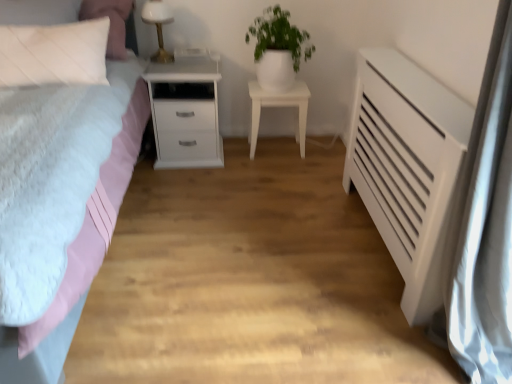
Question: Considering the positions of white matte radiator at right and white glossy table lamp at upper center in the image, is white matte radiator at right wider or thinner than white glossy table lamp at upper center?

Choices:
 (A) thin
 (B) wide

Answer: (B)

Question: Considering their positions, is white matte radiator at right located in front of or behind white glossy table lamp at upper center?

Choices:
 (A) front
 (B) behind

Answer: (A)

Question: Which object is the farthest from the white glossy table lamp at upper center?

Choices:
 (A) white glossy nightstand at center, acting as the second nightstand starting from the left
 (B) white glossy pot at upper center
 (C) matte pink bed at left
 (D) white quilted pillow at upper left
 (E) white matte nightstand at left, the 2th nightstand in the right-to-left sequence

Answer: (A)

Question: Estimate the real-world distances between objects in this image. Which object is farther from the white matte radiator at right?

Choices:
 (A) matte pink bed at left
 (B) white matte nightstand at left, the 2th nightstand in the right-to-left sequence
 (C) white glossy pot at upper center
 (D) white glossy nightstand at center, acting as the second nightstand starting from the left
 (E) white glossy table lamp at upper center

Answer: (E)